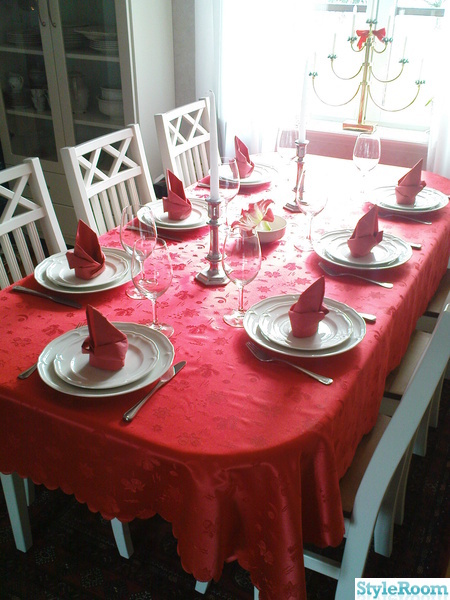
The image size is (450, 600). I want to click on dinner knife, so click(x=63, y=301), click(x=168, y=375), click(x=366, y=317), click(x=413, y=244), click(x=173, y=239), click(x=201, y=185).